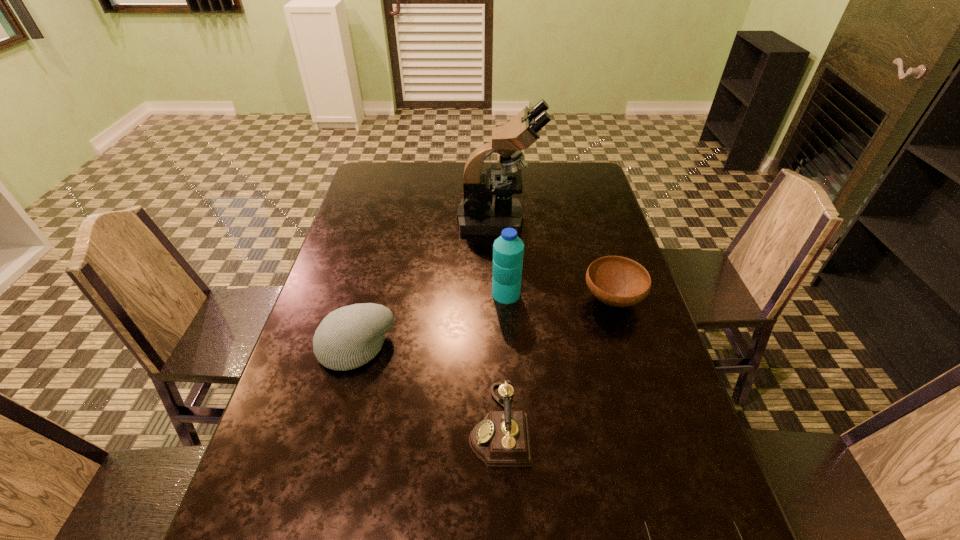
The height and width of the screenshot is (540, 960). I want to click on vacant space situated 0.060m on the dial of the telephone, so click(442, 425).

Image resolution: width=960 pixels, height=540 pixels. Find the location of `vacant space situated on the dial of the telephone`. vacant space situated on the dial of the telephone is located at coordinates (335, 425).

This screenshot has height=540, width=960. Find the location of `vacant area situated on the dial of the telephone`. vacant area situated on the dial of the telephone is located at coordinates (409, 425).

Identify the location of blank space located 0.190m on the front of the bowl. (638, 383).

Where is `object present at the left edge`? object present at the left edge is located at coordinates (349, 337).

This screenshot has height=540, width=960. In order to click on object that is at the right edge in this screenshot , I will do `click(617, 281)`.

What are the coordinates of `vacant space at the left edge` in the screenshot? It's located at (376, 228).

Identify the location of vacant space at the right edge of the desktop. The height and width of the screenshot is (540, 960). (565, 219).

Identify the location of blank area at the far left corner. (397, 171).

Locate an element on the screen. This screenshot has width=960, height=540. empty location between the farthest object and the second nearest object is located at coordinates (499, 322).